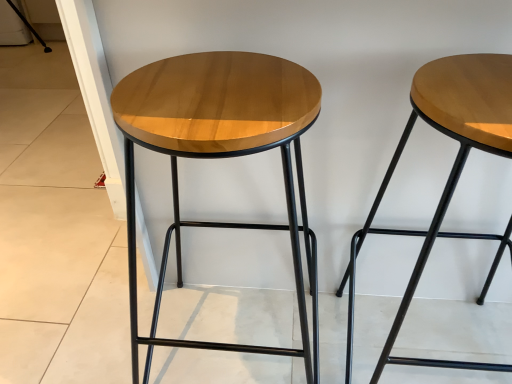
Identify the location of vacant area on top of wooden stool at center, arranged as the first stool when viewed from the left (from a real-world perspective). The image size is (512, 384). (211, 90).